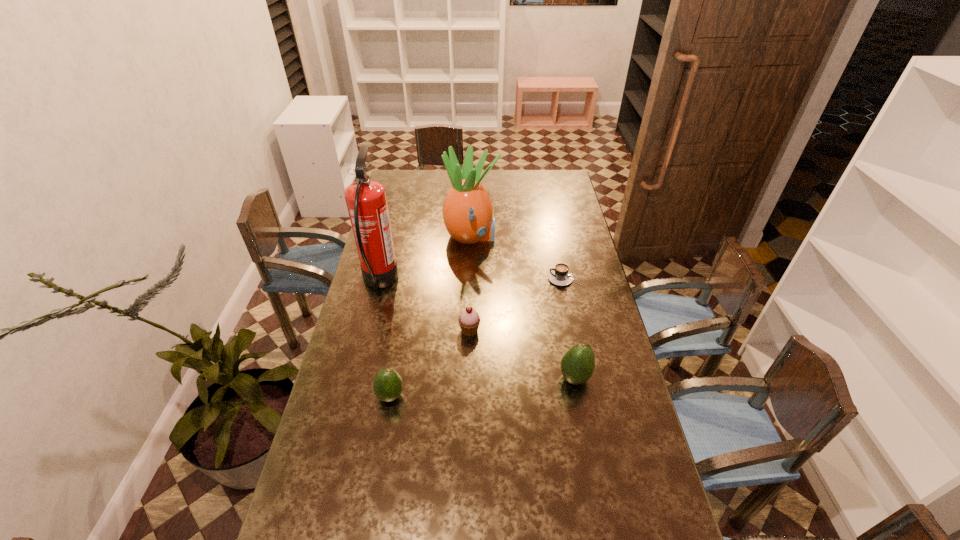
The image size is (960, 540). I want to click on the left avocado, so click(x=387, y=386).

You are a GUI agent. You are given a task and a screenshot of the screen. Output one action in this format:
    pyautogui.click(x=<x>, y=<y>)
    Task: Click on the shorter avocado
    The width and height of the screenshot is (960, 540).
    Given the screenshot: What is the action you would take?
    pyautogui.click(x=387, y=386)

The width and height of the screenshot is (960, 540). Identify the location of the right avocado. (577, 364).

Locate an element on the screen. Image resolution: width=960 pixels, height=540 pixels. the taller avocado is located at coordinates (577, 364).

This screenshot has width=960, height=540. Identify the location of the farthest object. tap(467, 211).

In order to click on pineapple in this screenshot , I will do `click(467, 211)`.

You are a GUI agent. You are given a task and a screenshot of the screen. Output one action in this format:
    pyautogui.click(x=<x>, y=<y>)
    Task: Click on the shortest object
    The height and width of the screenshot is (540, 960).
    Given the screenshot: What is the action you would take?
    pyautogui.click(x=560, y=276)

Identify the location of cupcake. (469, 320).

Locate an element on the screen. This screenshot has height=540, width=960. the tallest object is located at coordinates pos(366,201).

Where is `the leftmost object`? the leftmost object is located at coordinates (366, 201).